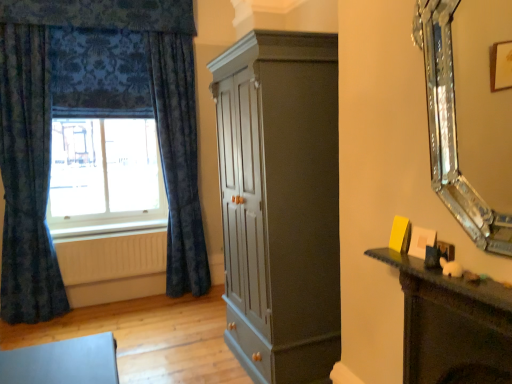
Question: Is velvety blue curtain at left, which is the 2th curtain from left to right, taller or shorter than dark blue textured curtain at left, the second curtain positioned from the right?

Choices:
 (A) short
 (B) tall

Answer: (A)

Question: Based on their positions, is velvety blue curtain at left, which is the 2th curtain from left to right, located to the left or right of dark blue textured curtain at left, the second curtain positioned from the right?

Choices:
 (A) right
 (B) left

Answer: (A)

Question: Which is nearer to the white wood at lower left?

Choices:
 (A) matte gray cupboard at center
 (B) blue velvet curtains at left
 (C) velvety blue curtain at left, which is the 2th curtain from left to right
 (D) wooden radiator at lower left
 (E) silver/glass mirror at right

Answer: (D)

Question: Which object is positioned closest to the white wood at lower left?

Choices:
 (A) dark blue textured curtain at left, marked as the first curtain in a left-to-right arrangement
 (B) wooden radiator at lower left
 (C) matte gray cupboard at center
 (D) silver/glass mirror at right
 (E) velvety blue curtain at left, which is the 2th curtain from left to right

Answer: (B)